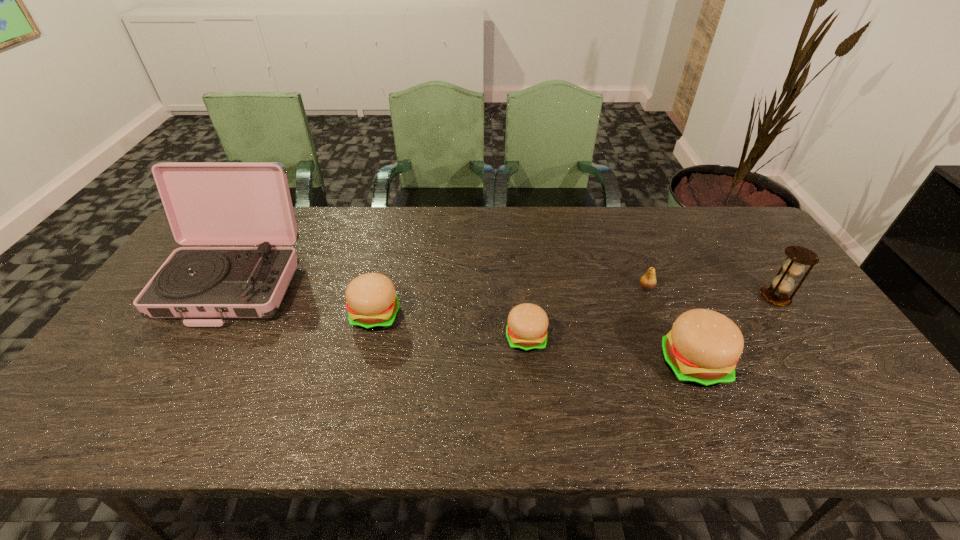
Identify the location of the second shortest hamburger. This screenshot has height=540, width=960. (372, 304).

At what (x,y) coordinates should I click in order to perform the action: click on the third shortest object. Please return your answer as a coordinate pair (x, y). This screenshot has width=960, height=540. Looking at the image, I should click on (372, 304).

Identify the location of the fourth object from right to left. Image resolution: width=960 pixels, height=540 pixels. (526, 330).

What are the coordinates of `the second hamburger from left to right` in the screenshot? It's located at (526, 330).

Where is `the rightmost hamburger`? The image size is (960, 540). the rightmost hamburger is located at coordinates (702, 349).

Where is `pear`? pear is located at coordinates (648, 281).

Locate an element on the screen. record player is located at coordinates (207, 203).

The image size is (960, 540). Find the location of `the leftmost object`. the leftmost object is located at coordinates (207, 203).

Identify the location of the rightmost object. [x=797, y=256].

Locate an element on the screen. vacant space located on the front of the second object from left to right is located at coordinates (362, 373).